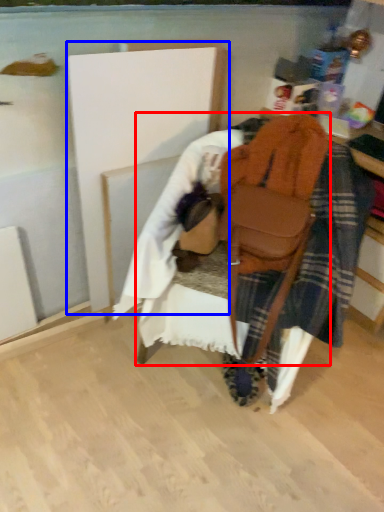
Question: Which object is closer to the camera taking this photo, furniture (highlighted by a red box) or wood (highlighted by a blue box)?

Choices:
 (A) furniture
 (B) wood

Answer: (A)